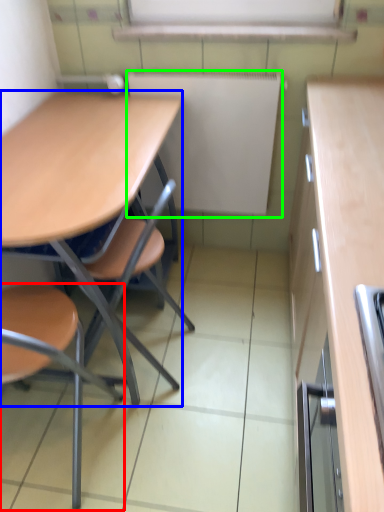
Question: Which object is positioned closest to chair (highlighted by a red box)? Select from desk (highlighted by a blue box) and bulletin board (highlighted by a green box).

Choices:
 (A) desk
 (B) bulletin board

Answer: (A)